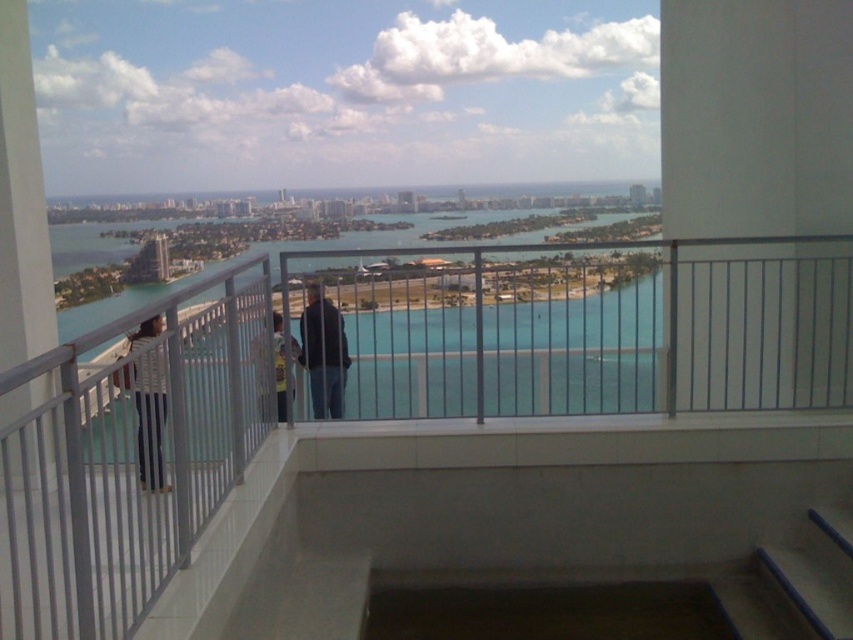
You are a delivery drone with a wingspan of 1.5 meters. You need to land on the balcony shown in the image. The white metal railing at upper center is in your path. Can you safely navigate under the railing without hitting it?

The white metal railing at upper center is 1.92 meters away from the camera. Since your drone has a wingspan of 1.5 meters, which is narrower than the distance to the railing, you can safely navigate under it without hitting it.

You are standing on a balcony and want to take a photo of the scenic view. The white metal railing at upper center is blocking part of the view. To avoid the railing, should you move to your left or right?

The white metal railing at upper center is located at point (390, 385). Since the railing is at the upper center, moving to either side would shift your position away from the center. To avoid the railing, you should move to your left or right, depending on the direction you want to go. However, since the railing is at the center, moving to either side would help avoid it.